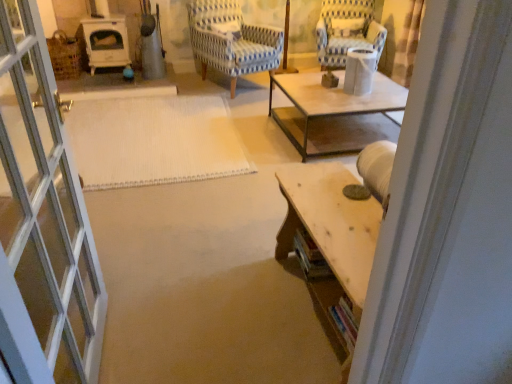
Find the location of a particular element. free point above white woven mat at center (from a real-world perspective) is located at coordinates (141, 136).